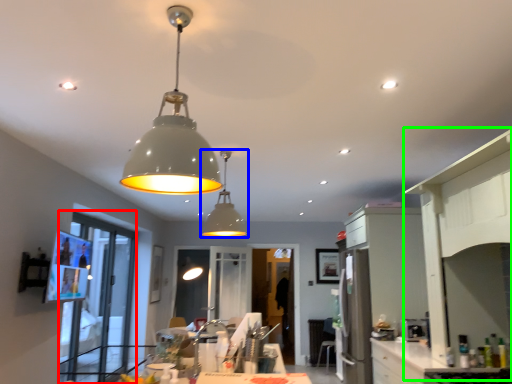
Question: Which object is positioned closest to glass door (highlighted by a red box)? Select from lamp (highlighted by a blue box) and side (highlighted by a green box).

Choices:
 (A) lamp
 (B) side

Answer: (A)